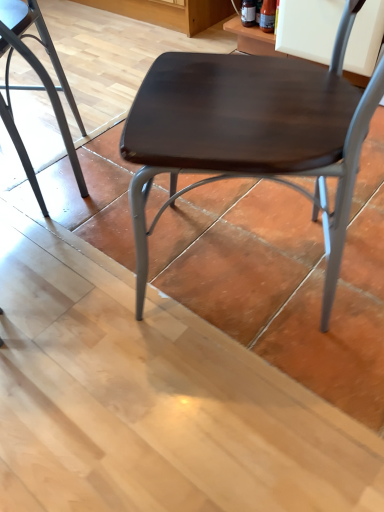
Find the location of a particular element. The image size is (384, 512). vacant region below dark wood/matte chair at center, placed as the 1th chair when sorted from right to left (from a real-world perspective) is located at coordinates pos(251,262).